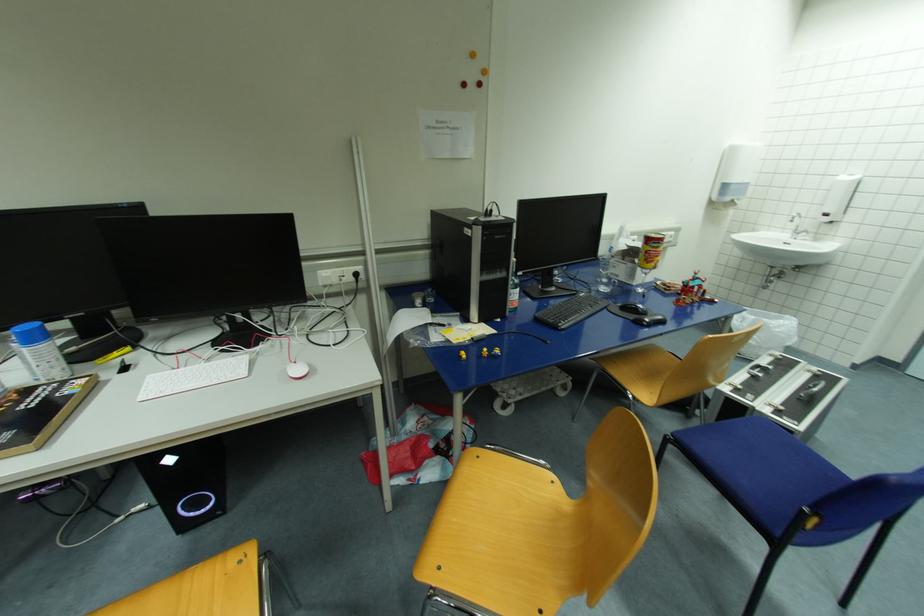
Locate an element on the screen. Image resolution: width=924 pixels, height=616 pixels. plastic water bottle is located at coordinates (38, 352).